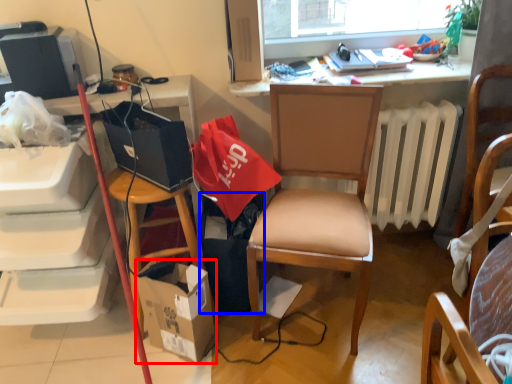
Question: Which object appears closest to the camera in this image, box (highlighted by a red box) or trash bin/can (highlighted by a blue box)?

Choices:
 (A) box
 (B) trash bin/can

Answer: (A)